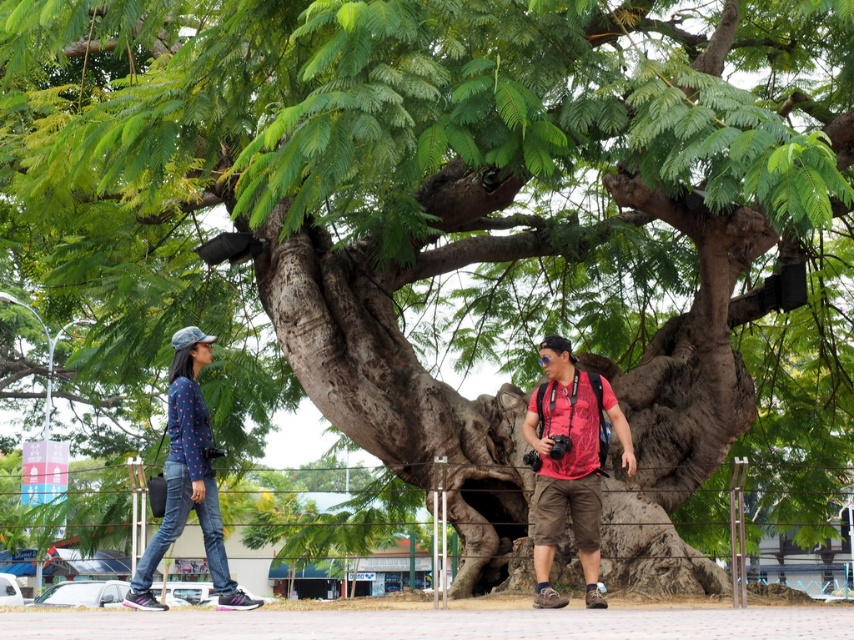
Question: Where is matte red shirt at center located in relation to denim jeans at left in the image?

Choices:
 (A) below
 (B) above

Answer: (A)

Question: Which of the following is the farthest from the observer?

Choices:
 (A) (206, 499)
 (B) (594, 426)

Answer: (B)

Question: Can you confirm if matte red shirt at center is thinner than denim jeans at left?

Choices:
 (A) no
 (B) yes

Answer: (B)

Question: Which object appears farthest from the camera in this image?

Choices:
 (A) denim jeans at left
 (B) matte red shirt at center

Answer: (B)

Question: Does matte red shirt at center have a greater width compared to denim jeans at left?

Choices:
 (A) no
 (B) yes

Answer: (A)